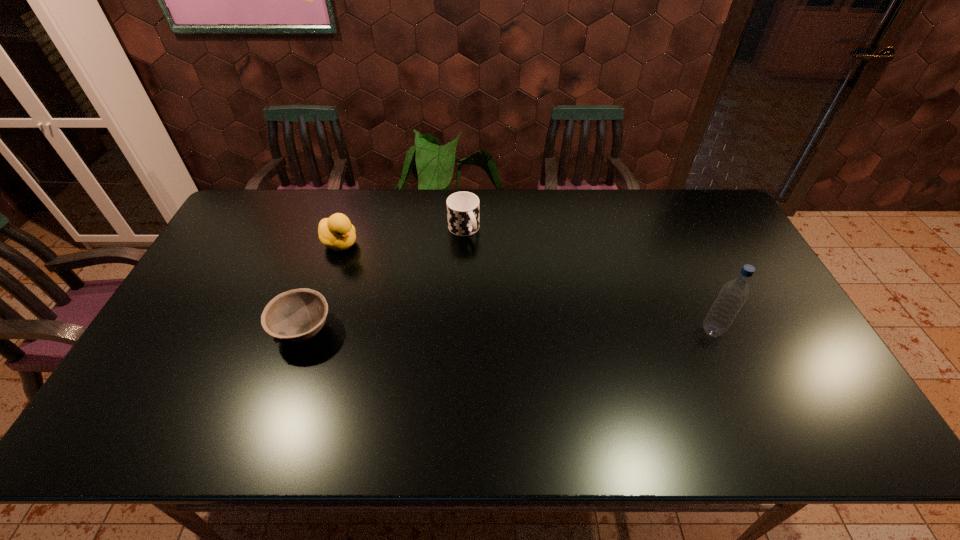
Find the location of a particular element. The width and height of the screenshot is (960, 540). free space that is in between the water bottle and the second tallest object is located at coordinates (526, 287).

Image resolution: width=960 pixels, height=540 pixels. In order to click on empty space between the shortest object and the duck in this screenshot , I will do `click(322, 287)`.

Identify the location of unoccupied position between the second shortest object and the second tallest object. (401, 237).

Where is `vacant space that is in between the second tallest object and the water bottle`? The width and height of the screenshot is (960, 540). vacant space that is in between the second tallest object and the water bottle is located at coordinates (526, 287).

Find the location of `free point between the water bottle and the second tallest object`. free point between the water bottle and the second tallest object is located at coordinates (526, 287).

Locate an element on the screen. vacant point located between the shortest object and the rightmost object is located at coordinates (508, 331).

The height and width of the screenshot is (540, 960). In order to click on vacant space that's between the shortest object and the cup in this screenshot , I will do `click(383, 280)`.

Identify the location of free space between the tallest object and the third shortest object. (526, 287).

Where is `free spot between the tallest object and the cup`? This screenshot has width=960, height=540. free spot between the tallest object and the cup is located at coordinates (588, 280).

Select which object appears as the third closest to the tallest object. Please provide its 2D coordinates. Your answer should be formatted as a tuple, i.e. [(x, y)], where the tuple contains the x and y coordinates of a point satisfying the conditions above.

[(336, 232)]